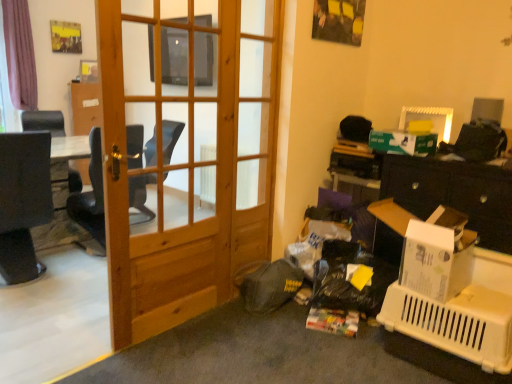
Question: From the image's perspective, would you say white plastic picture frame at upper right is shown under black leather chair at left?

Choices:
 (A) no
 (B) yes

Answer: (A)

Question: From the image's perspective, is white plastic picture frame at upper right above black leather chair at left?

Choices:
 (A) no
 (B) yes

Answer: (B)

Question: Is white plastic picture frame at upper right in front of black leather chair at left?

Choices:
 (A) no
 (B) yes

Answer: (B)

Question: Could you tell me if white plastic picture frame at upper right is turned towards black leather chair at left?

Choices:
 (A) yes
 (B) no

Answer: (B)

Question: Can you see white plastic picture frame at upper right touching black leather chair at left?

Choices:
 (A) no
 (B) yes

Answer: (A)

Question: From the image's perspective, is natural wood door at center located above or below green cardboard box at upper right?

Choices:
 (A) above
 (B) below

Answer: (B)

Question: Choose the correct answer: Is natural wood door at center inside green cardboard box at upper right or outside it?

Choices:
 (A) inside
 (B) outside

Answer: (B)

Question: From a real-world perspective, is natural wood door at center physically located above or below green cardboard box at upper right?

Choices:
 (A) below
 (B) above

Answer: (A)

Question: Considering the positions of natural wood door at center and green cardboard box at upper right in the image, is natural wood door at center wider or thinner than green cardboard box at upper right?

Choices:
 (A) wide
 (B) thin

Answer: (B)

Question: Considering the positions of natural wood door at center and black leather chair at left in the image, is natural wood door at center taller or shorter than black leather chair at left?

Choices:
 (A) short
 (B) tall

Answer: (B)

Question: Would you say natural wood door at center is inside or outside black leather chair at left?

Choices:
 (A) outside
 (B) inside

Answer: (A)

Question: Considering the positions of natural wood door at center and black leather chair at left in the image, is natural wood door at center wider or thinner than black leather chair at left?

Choices:
 (A) thin
 (B) wide

Answer: (A)

Question: From a real-world perspective, is natural wood door at center physically located above or below black leather chair at left?

Choices:
 (A) below
 (B) above

Answer: (B)

Question: In the image, is black leather chair at left positioned in front of or behind white cardboard box at right?

Choices:
 (A) behind
 (B) front

Answer: (A)

Question: Is black leather chair at left spatially inside white cardboard box at right, or outside of it?

Choices:
 (A) inside
 (B) outside

Answer: (B)